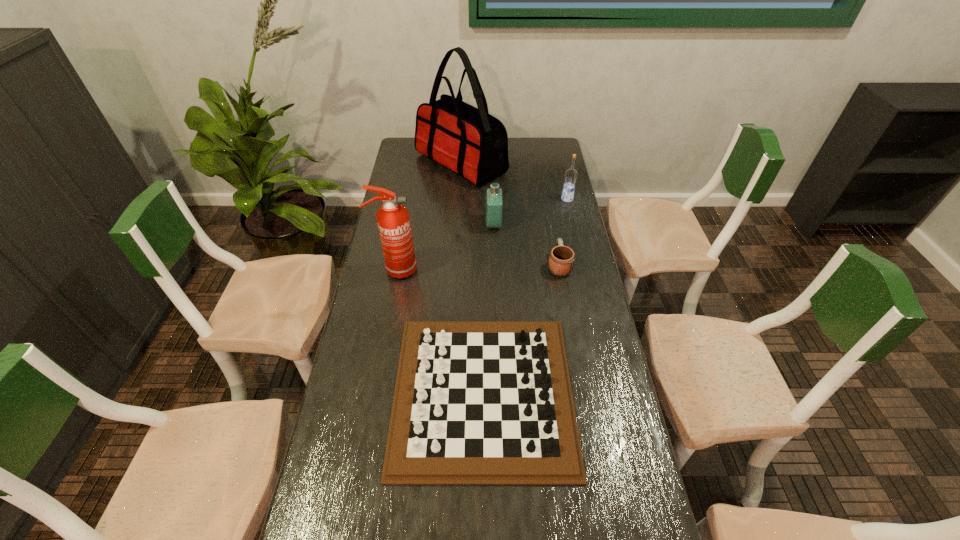
You are a GUI agent. You are given a task and a screenshot of the screen. Output one action in this format:
    pyautogui.click(x=<x>, y=<y>)
    Task: Click on the duffel bag
    This screenshot has height=540, width=960.
    Given the screenshot: What is the action you would take?
    pyautogui.click(x=469, y=141)

Identify the location of the farthest object. (469, 141).

Locate an element on the screen. The width and height of the screenshot is (960, 540). the fifth shortest object is located at coordinates (393, 220).

I want to click on vodka, so click(571, 174).

Image resolution: width=960 pixels, height=540 pixels. I want to click on the rightmost object, so click(571, 174).

At what (x,y) coordinates should I click in order to perform the action: click on the third farthest object. Please return your answer as a coordinate pair (x, y). Looking at the image, I should click on (494, 194).

Identify the location of gameboard. (476, 402).

Where is `mug`? Image resolution: width=960 pixels, height=540 pixels. mug is located at coordinates (562, 258).

You are a GUI agent. You are given a task and a screenshot of the screen. Output one action in this format:
    pyautogui.click(x=<x>, y=<y>)
    Task: Click on the vacant region located 0.250m on the front of the farthest object
    This screenshot has width=960, height=540.
    Given the screenshot: What is the action you would take?
    pyautogui.click(x=458, y=227)

The width and height of the screenshot is (960, 540). Find the location of `blank space located 0.340m at the nozzle of the fifth shortest object`. blank space located 0.340m at the nozzle of the fifth shortest object is located at coordinates (511, 270).